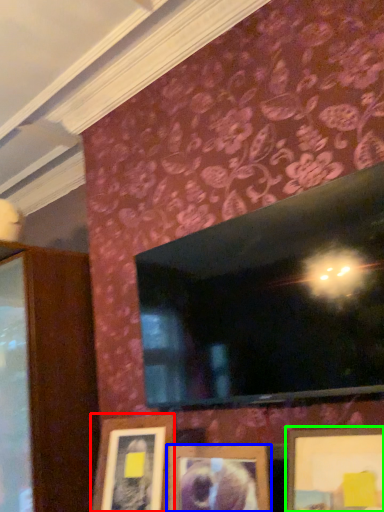
Question: Estimate the real-world distances between objects in this image. Which object is farther from picture frame (highlighted by a red box), picture frame (highlighted by a blue box) or picture frame (highlighted by a green box)?

Choices:
 (A) picture frame
 (B) picture frame

Answer: (B)